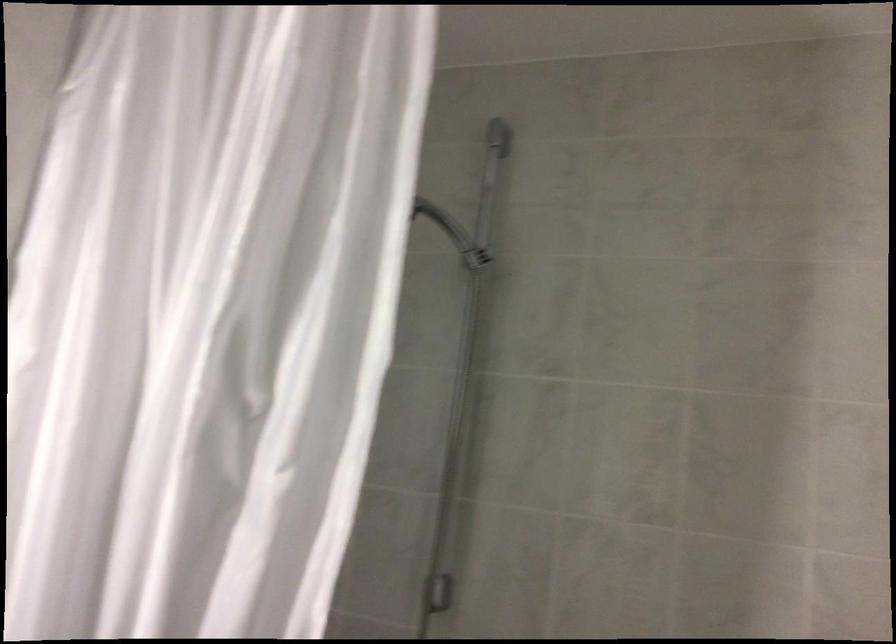
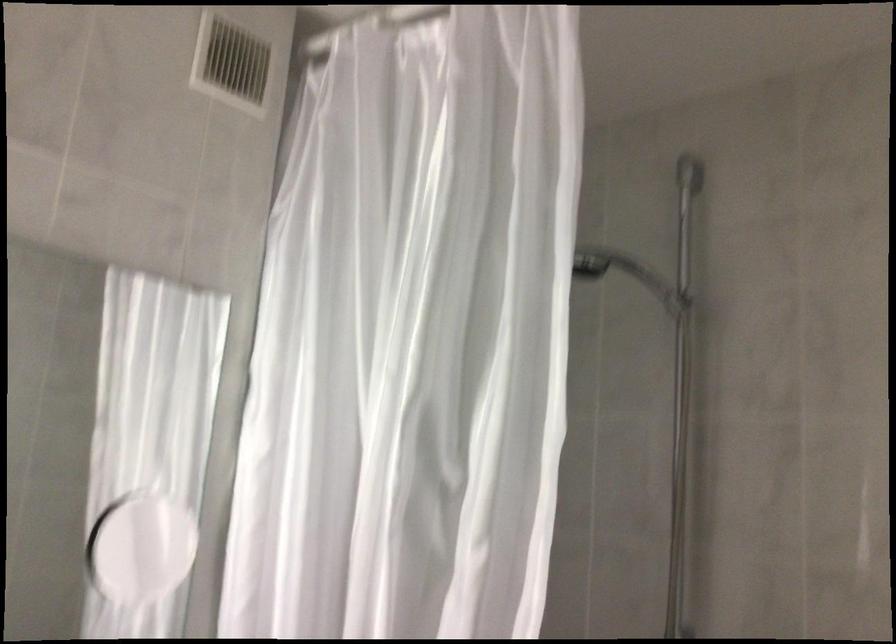
Question: Which direction would the cameraman need to move to produce the second image? Reply with the corresponding letter.

Choices:
 (A) Left
 (B) Right
 (C) Forward
 (D) Backward

Answer: (B)